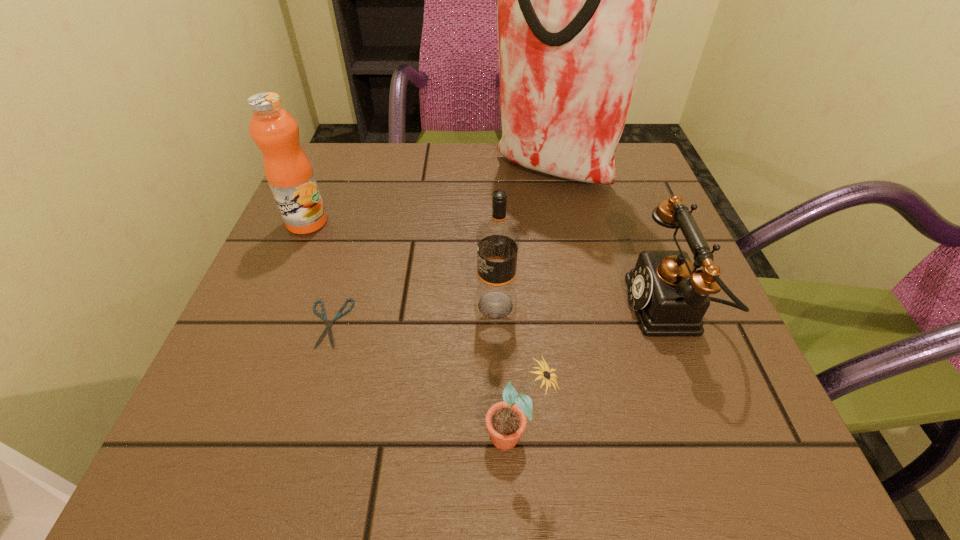
Image resolution: width=960 pixels, height=540 pixels. In order to click on free space between the telephone and the vodka in this screenshot , I will do `click(583, 307)`.

Where is `free space between the fruit juice and the vodka`? The width and height of the screenshot is (960, 540). free space between the fruit juice and the vodka is located at coordinates (401, 264).

Where is `free space between the leftmost object and the vodka`? free space between the leftmost object and the vodka is located at coordinates (401, 264).

Identify the location of free space between the fruit juice and the shortest object. This screenshot has height=540, width=960. 318,273.

Identify which object is the fifth nearest to the second farthest object. Please provide its 2D coordinates. Your answer should be formatted as a tuple, i.e. [(x, y)], where the tuple contains the x and y coordinates of a point satisfying the conditions above.

[(670, 298)]

Select which object is the fourth closest to the tallest object. Please provide its 2D coordinates. Your answer should be formatted as a tuple, i.e. [(x, y)], where the tuple contains the x and y coordinates of a point satisfying the conditions above.

[(328, 325)]